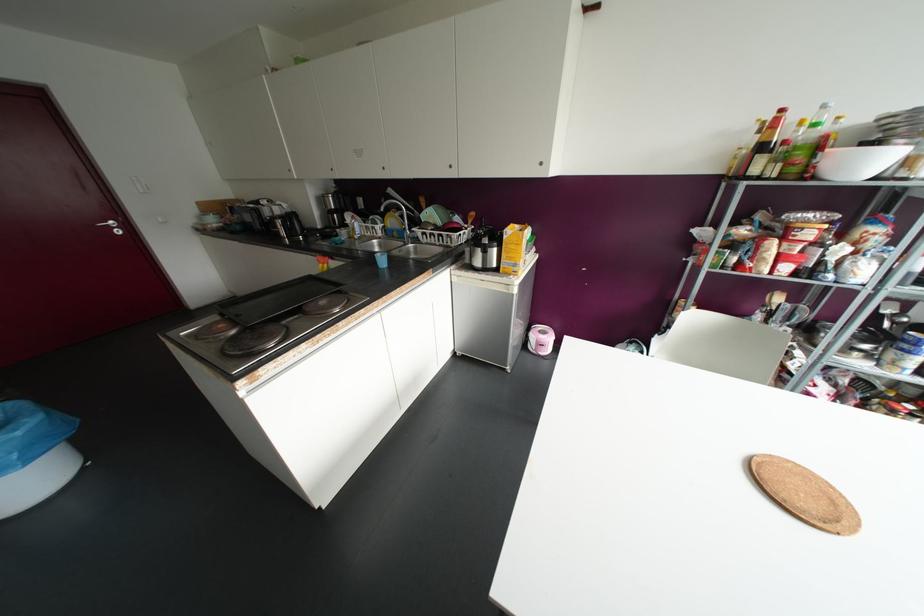
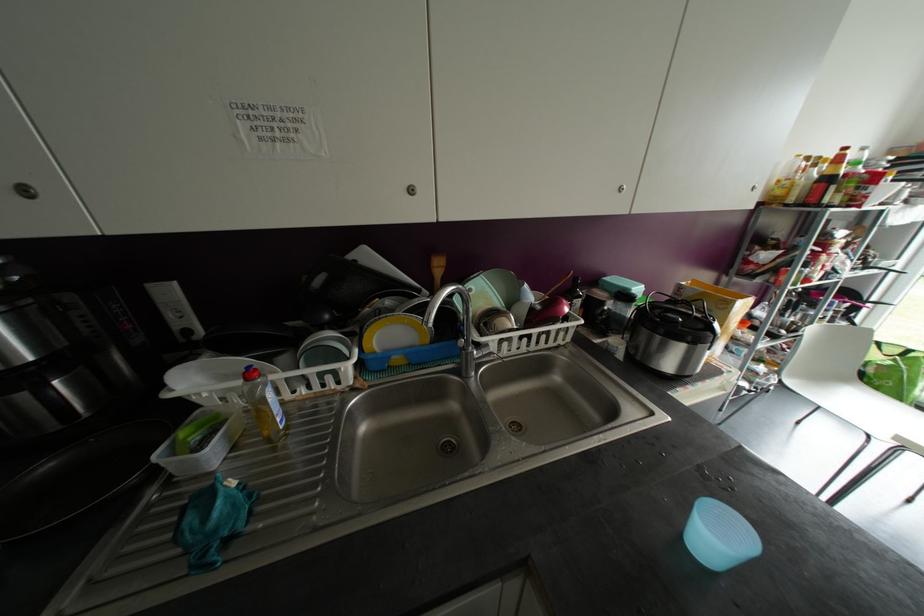
Find the pixel in the second image that matches point (359, 238) in the first image.

(286, 427)